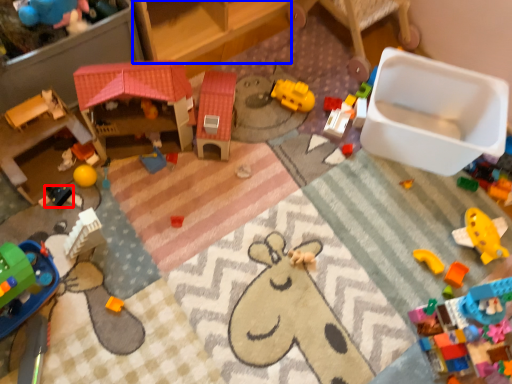
Question: Which object is closer to the camera taking this photo, toy (highlighted by a red box) or furniture (highlighted by a blue box)?

Choices:
 (A) toy
 (B) furniture

Answer: (B)